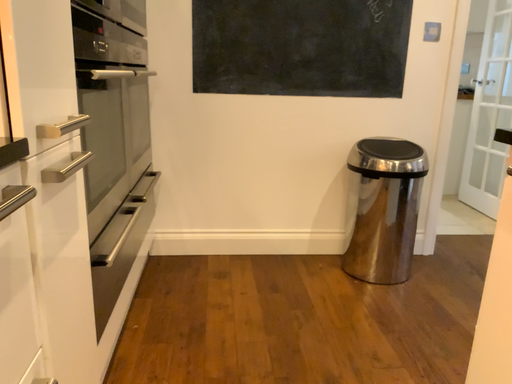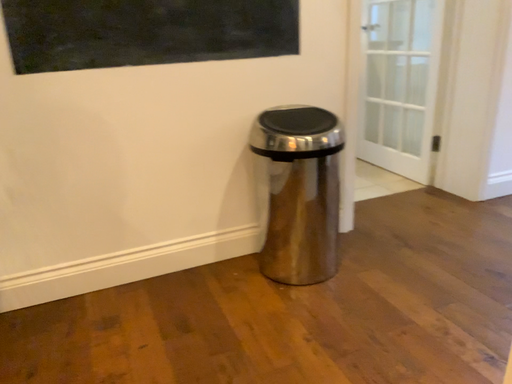
Question: How did the camera likely rotate when shooting the video?

Choices:
 (A) rotated left
 (B) rotated right

Answer: (B)